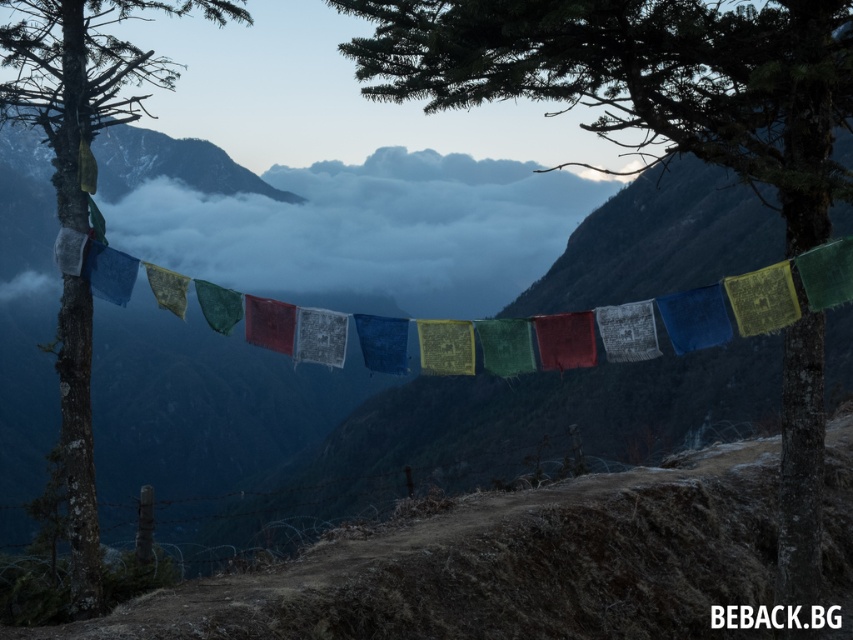
Is green textured flag at center positioned before smooth bark tree at left?

Yes, it is.

Does point (815, 534) come farther from viewer compared to point (22, 64)?

That is False.

Find the location of a particular element. The image size is (853, 640). green textured flag at center is located at coordinates (643, 77).

Which is behind, point (804, 182) or point (459, 259)?

Positioned behind is point (459, 259).

Does green textured flag at center appear over cloudy sky at center?

Incorrect, green textured flag at center is not positioned above cloudy sky at center.

Who is more distant from viewer, (x=811, y=378) or (x=396, y=280)?

Point (x=396, y=280)

This screenshot has width=853, height=640. In order to click on green textured flag at center in this screenshot , I will do `click(643, 77)`.

Does cloudy sky at center have a greater width compared to smooth bark tree at left?

Yes, cloudy sky at center is wider than smooth bark tree at left.

Which is below, cloudy sky at center or smooth bark tree at left?

Positioned lower is cloudy sky at center.

Is point (488, 225) positioned after point (22, 4)?

Yes, it is.

Identify the location of cloudy sky at center. [x=367, y=228].